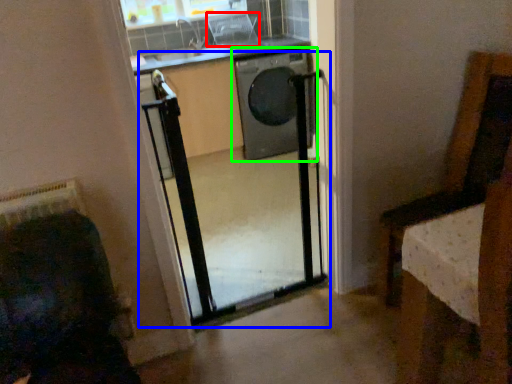
Question: Which is farther away from armchair (highlighted by a red box)? screen door (highlighted by a blue box) or washing machine (highlighted by a green box)?

Choices:
 (A) screen door
 (B) washing machine

Answer: (A)